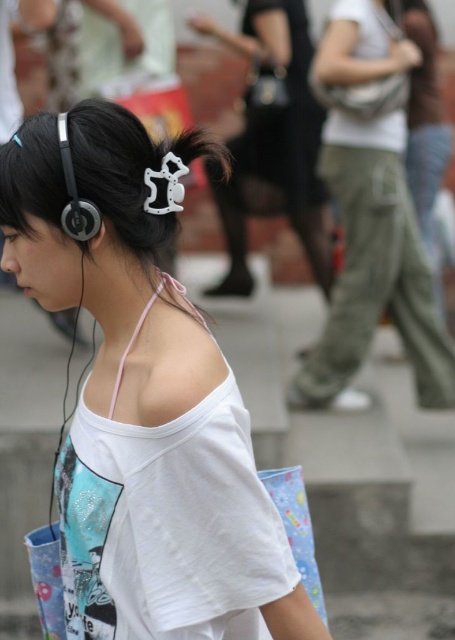
Which is below, green cotton pants at center or matte black hair clip at upper center?

green cotton pants at center is lower down.

Based on the photo, does green cotton pants at center have a smaller size compared to matte black hair clip at upper center?

No, green cotton pants at center is not smaller than matte black hair clip at upper center.

The image size is (455, 640). Describe the element at coordinates (374, 268) in the screenshot. I see `green cotton pants at center` at that location.

At what (x,y) coordinates should I click in order to perform the action: click on green cotton pants at center. Please return your answer as a coordinate pair (x, y). This screenshot has width=455, height=640. Looking at the image, I should click on (374, 268).

Is white matte t-shirt at center above matte black hair clip at upper center?

No, white matte t-shirt at center is not above matte black hair clip at upper center.

Between white matte t-shirt at center and matte black hair clip at upper center, which one has less height?

With less height is white matte t-shirt at center.

Does point (25, 269) lie in front of point (296, 16)?

Yes, it is.

You are a GUI agent. You are given a task and a screenshot of the screen. Output one action in this format:
    pyautogui.click(x=<x>, y=<y>)
    Task: Click on the white matte t-shirt at center
    The image size is (455, 640).
    Given the screenshot: What is the action you would take?
    pyautogui.click(x=145, y=404)

Between white matte t-shirt at center and matte black earphone at upper left, which one appears on the left side from the viewer's perspective?

matte black earphone at upper left

Between point (45, 262) and point (86, 232), which one is positioned behind?

Point (45, 262)

Locate an element on the screen. This screenshot has width=455, height=640. white matte t-shirt at center is located at coordinates (145, 404).